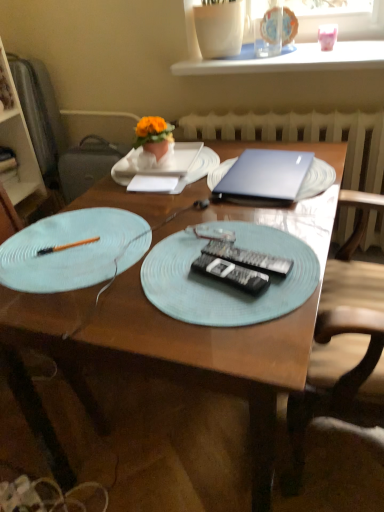
Identify the location of free space that is in between orange fabric flower at upper center and black plastic remote control at center, marked as the 1th remote control in a bottom-to-top arrangement. (186, 210).